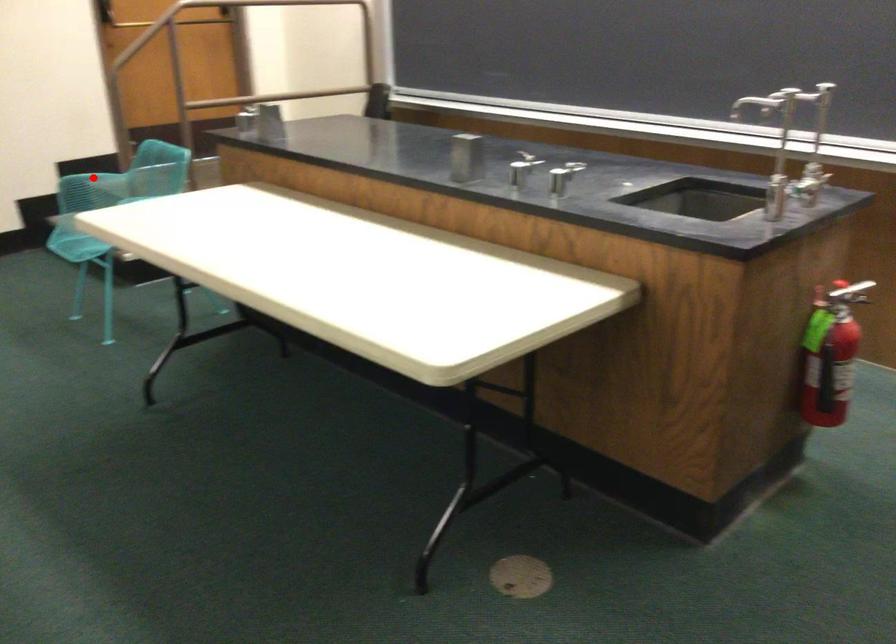
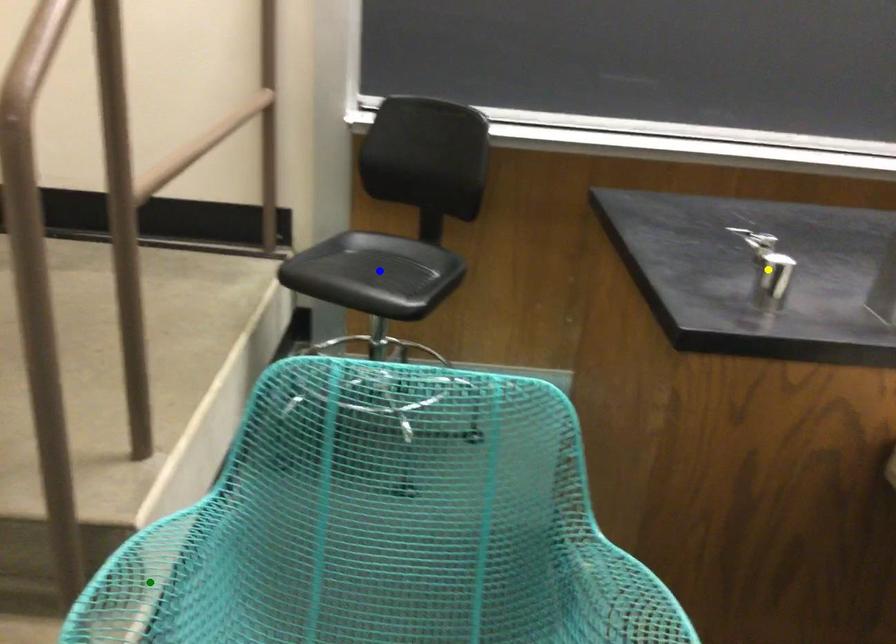
Question: I am providing you with two images of the same scene from different viewpoints. A red point is marked on the first image. You are given multiple points on the second image. Which mark in image 2 goes with the point in image 1?

Choices:
 (A) blue point
 (B) yellow point
 (C) green point

Answer: (C)